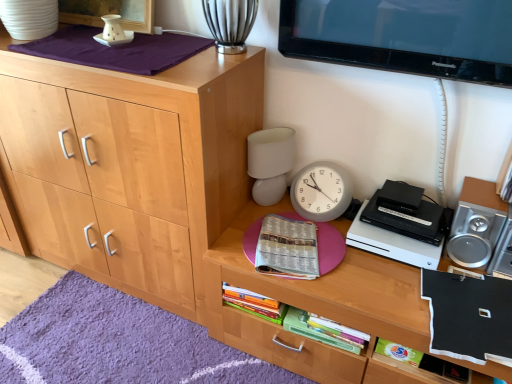
Question: Is purple soft rug at lower left with black plastic dvd player at right?

Choices:
 (A) yes
 (B) no

Answer: (B)

Question: Is purple soft rug at lower left taller than black plastic dvd player at right?

Choices:
 (A) yes
 (B) no

Answer: (B)

Question: From a real-world perspective, is purple soft rug at lower left on black plastic dvd player at right?

Choices:
 (A) no
 (B) yes

Answer: (A)

Question: Is purple soft rug at lower left thinner than black plastic dvd player at right?

Choices:
 (A) no
 (B) yes

Answer: (A)

Question: Is purple soft rug at lower left surrounding black plastic dvd player at right?

Choices:
 (A) no
 (B) yes

Answer: (A)

Question: Is black matte book at lower right, the 3th book from the left, bigger or smaller than purple soft rug at lower left?

Choices:
 (A) big
 (B) small

Answer: (B)

Question: From a real-world perspective, is black matte book at lower right, the 3th book from the left, positioned above or below purple soft rug at lower left?

Choices:
 (A) below
 (B) above

Answer: (B)

Question: Considering the positions of point (470, 334) and point (53, 344), is point (470, 334) closer or farther from the camera than point (53, 344)?

Choices:
 (A) closer
 (B) farther

Answer: (A)

Question: Considering the positions of black matte book at lower right, acting as the 1th book starting from the right, and purple soft rug at lower left in the image, is black matte book at lower right, acting as the 1th book starting from the right, wider or thinner than purple soft rug at lower left?

Choices:
 (A) wide
 (B) thin

Answer: (B)

Question: From their relative heights in the image, would you say printed paper book at center, the third book from the right, is taller or shorter than green matte book at lower right, the 2th book when ordered from left to right?

Choices:
 (A) tall
 (B) short

Answer: (A)

Question: Is printed paper book at center, positioned as the 1th book in left-to-right order, situated inside green matte book at lower right, marked as the second book in a right-to-left arrangement, or outside?

Choices:
 (A) inside
 (B) outside

Answer: (B)

Question: In the image, is printed paper book at center, the third book from the right, on the left side or the right side of green matte book at lower right, the 2th book when ordered from left to right?

Choices:
 (A) right
 (B) left

Answer: (B)

Question: Looking at the image, does printed paper book at center, the third book from the right, seem bigger or smaller compared to green matte book at lower right, marked as the second book in a right-to-left arrangement?

Choices:
 (A) big
 (B) small

Answer: (A)

Question: Is natural wood cabinet at left inside the boundaries of wooden desk at center, or outside?

Choices:
 (A) inside
 (B) outside

Answer: (B)

Question: In the image, is natural wood cabinet at left positioned in front of or behind wooden desk at center?

Choices:
 (A) behind
 (B) front

Answer: (A)